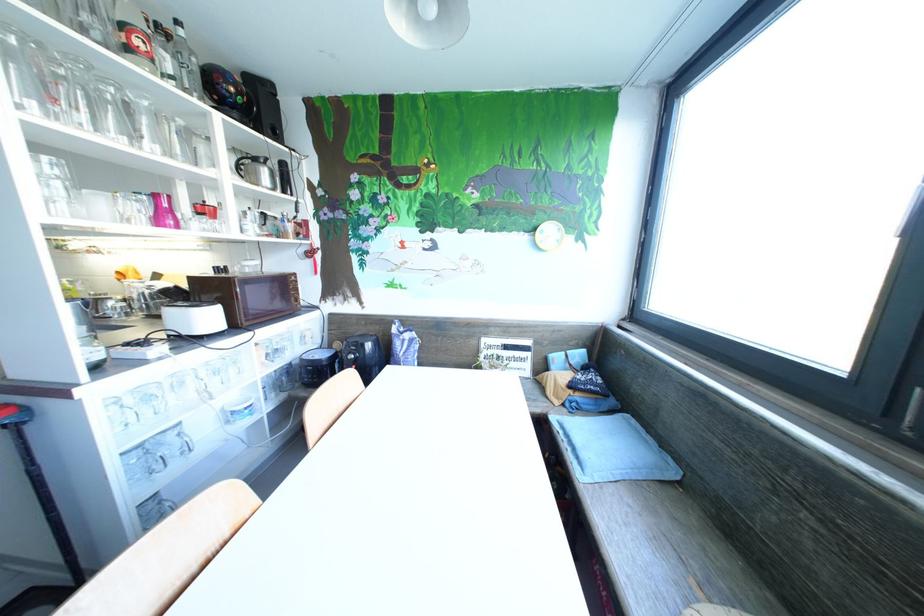
You are a GUI agent. You are given a task and a screenshot of the screen. Output one action in this format:
    pyautogui.click(x=<x>, y=<y>)
    Task: Click on the silver pitcher handle
    Image resolution: width=924 pixels, height=616 pixels.
    Given the screenshot: What is the action you would take?
    pyautogui.click(x=250, y=168)